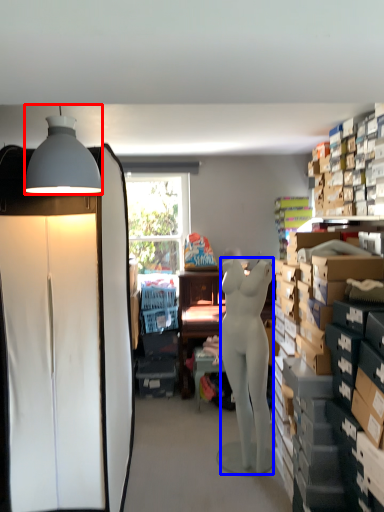
Question: Which point is closer to the camera, lamp (highlighted by a red box) or person (highlighted by a blue box)?

Choices:
 (A) lamp
 (B) person

Answer: (A)